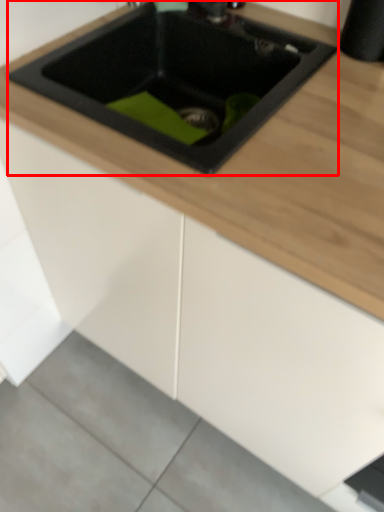
Question: Considering the relative positions of sink (annotated by the red box) and concrete in the image provided, where is sink (annotated by the red box) located with respect to the staircase?

Choices:
 (A) left
 (B) right

Answer: (B)